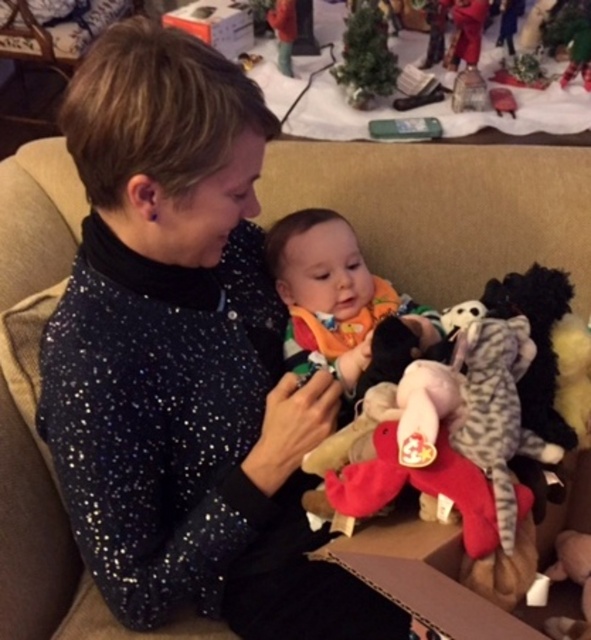
Question: Is soft orange bib at center above velvet plush toy at upper center?

Choices:
 (A) yes
 (B) no

Answer: (B)

Question: Which object is positioned farthest from the velvet plush toy at upper center?

Choices:
 (A) velvet plush reindeer at upper right
 (B) green plush toy at upper right
 (C) soft orange bib at center

Answer: (C)

Question: Which object is farther from the camera taking this photo?

Choices:
 (A) cardboard box at lower right
 (B) green plush toy at upper right
 (C) velvet plush toy at upper center

Answer: (B)

Question: Is soft orange bib at center smaller than velvet plush reindeer at upper right?

Choices:
 (A) no
 (B) yes

Answer: (A)

Question: Which of the following is the closest to the observer?

Choices:
 (A) (375, 304)
 (B) (482, 0)
 (C) (566, 8)
 (D) (430, 621)

Answer: (D)

Question: Is the position of velvet plush reindeer at upper right less distant than that of velvet plush toy at upper center?

Choices:
 (A) no
 (B) yes

Answer: (B)